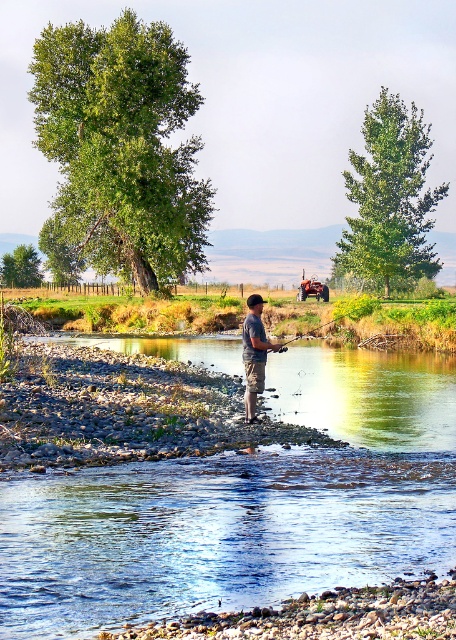
You are the fisherman in the image. You want to know which item you are holding is smaller between the light brown leather boots at center and the wooden fishing pole at center. Which one is it?

The light brown leather boots at center is smaller than the wooden fishing pole at center, so the smaller item you are holding is the light brown leather boots at center.

You are a photographer trying to capture the man fishing. You notice the light brown leather boots at center and the wooden fishing pole at center. Which object is taller in the image?

The light brown leather boots at center is taller than the wooden fishing pole at center.

Looking at this image, you are a photographer trying to capture the man fishing. You notice the light brown leather boots at center and the wooden fishing pole at center. From your position, which object is closer to you?

The light brown leather boots at center is closer to you because it is in front of the wooden fishing pole at center.